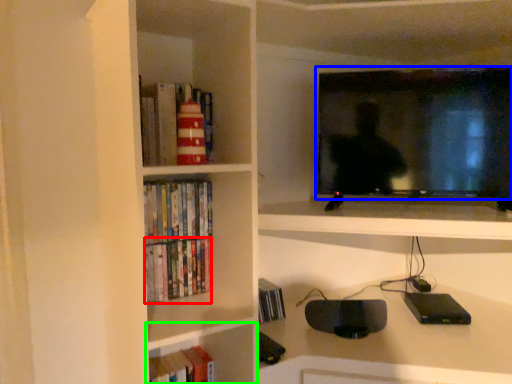
Question: Which is farther away from book (highlighted by a red box)? television (highlighted by a blue box) or shelf (highlighted by a green box)?

Choices:
 (A) television
 (B) shelf

Answer: (A)